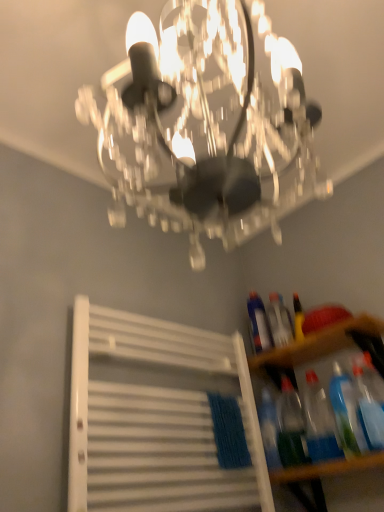
Question: Considering the relative positions of translucent plastic bottle at lower right, positioned as the 3th bottle in front-to-back order, and transparent plastic bottles at lower right in the image provided, is translucent plastic bottle at lower right, positioned as the 3th bottle in front-to-back order, to the left or to the right of transparent plastic bottles at lower right?

Choices:
 (A) right
 (B) left

Answer: (B)

Question: Is point (289, 378) positioned closer to the camera than point (286, 345)?

Choices:
 (A) closer
 (B) farther

Answer: (B)

Question: Which object is the closest to the translucent plastic bottle at lower right, the 2th bottle positioned from the front?

Choices:
 (A) white matte radiator at lower left
 (B) translucent plastic bottle at right, which appears as the 2th bottle when viewed from the back
 (C) clear crystal chandelier at upper center
 (D) wooden table at lower right
 (E) translucent plastic bottles at lower right, marked as the 5th bottle in a back-to-front arrangement

Answer: (E)

Question: Based on their relative distances, which object is nearer to the clear crystal chandelier at upper center?

Choices:
 (A) translucent plastic bottle at lower right, positioned as the 3th bottle in front-to-back order
 (B) transparent plastic bottles at lower right
 (C) wooden table at lower right
 (D) translucent plastic bottle at right, positioned as the 1th bottle in back-to-front order
 (E) white matte radiator at lower left

Answer: (E)